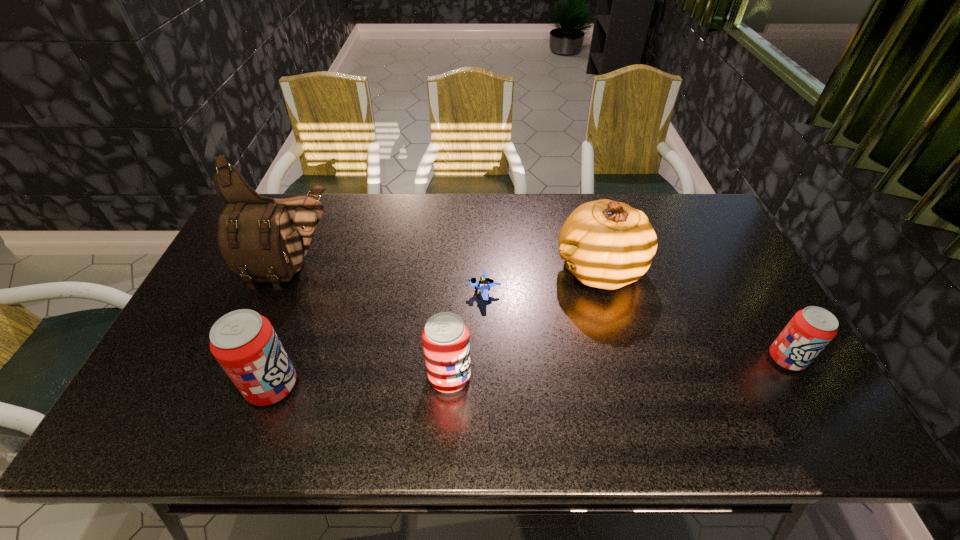
Identify the location of free space located 0.340m on the front face of the fifth object from left to right. The height and width of the screenshot is (540, 960). (442, 269).

Locate an element on the screen. This screenshot has width=960, height=540. vacant space located on the front face of the fifth object from left to right is located at coordinates (517, 269).

Locate an element on the screen. The width and height of the screenshot is (960, 540). vacant space located 0.340m on the front face of the fifth object from left to right is located at coordinates (442, 269).

Find the location of a particular element. This screenshot has height=540, width=960. vacant space located 0.150m on the front-facing side of the tallest object is located at coordinates (267, 334).

Where is `free space located on the front-facing side of the shortest object`? The height and width of the screenshot is (540, 960). free space located on the front-facing side of the shortest object is located at coordinates (368, 293).

Find the location of a particular element. The height and width of the screenshot is (540, 960). free space located on the front-facing side of the shortest object is located at coordinates (448, 293).

This screenshot has width=960, height=540. What are the coordinates of `vacant region located on the front-facing side of the shortest object` in the screenshot? It's located at (413, 293).

Identify the location of object at the left edge. The image size is (960, 540). point(262,239).

The width and height of the screenshot is (960, 540). I want to click on object located in the right edge section of the desktop, so click(810, 330).

The image size is (960, 540). Find the location of `object at the near right corner`. object at the near right corner is located at coordinates (810, 330).